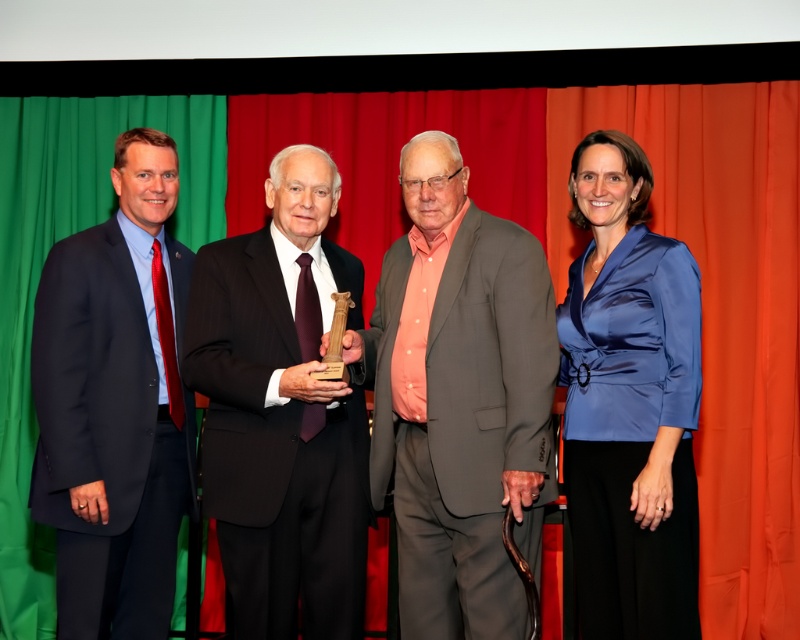
Question: Which point appears closest to the camera in this image?

Choices:
 (A) (564, 308)
 (B) (328, 493)
 (C) (484, 458)

Answer: (C)

Question: Among these objects, which one is nearest to the camera?

Choices:
 (A) black pinstripe suit at center
 (B) satin blue blouse at right
 (C) gray fabric suit at center
 (D) navy blue suit at left

Answer: (C)

Question: Among these points, which one is farthest from the camera?

Choices:
 (A) (182, 472)
 (B) (377, 285)

Answer: (A)

Question: Does black pinstripe suit at center have a greater width compared to navy blue suit at left?

Choices:
 (A) no
 (B) yes

Answer: (B)

Question: Is the position of black pinstripe suit at center more distant than that of navy blue suit at left?

Choices:
 (A) no
 (B) yes

Answer: (A)

Question: Is gray fabric suit at center below black pinstripe suit at center?

Choices:
 (A) no
 (B) yes

Answer: (A)